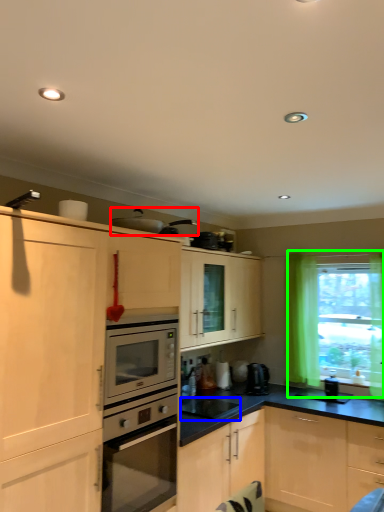
Question: Which is nearer to the appliance (highlighted by a red box)? appliance (highlighted by a blue box) or window (highlighted by a green box).

Choices:
 (A) appliance
 (B) window

Answer: (A)